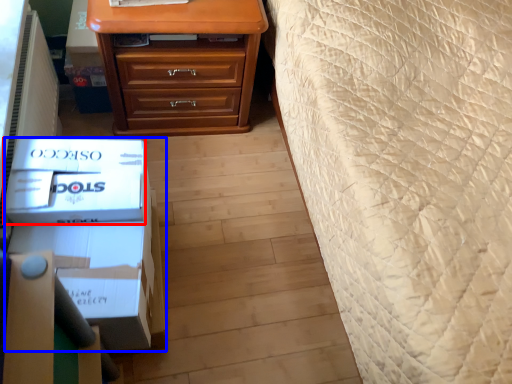
Question: Which object is closer to the camera taking this photo, box (highlighted by a red box) or box (highlighted by a blue box)?

Choices:
 (A) box
 (B) box

Answer: (B)